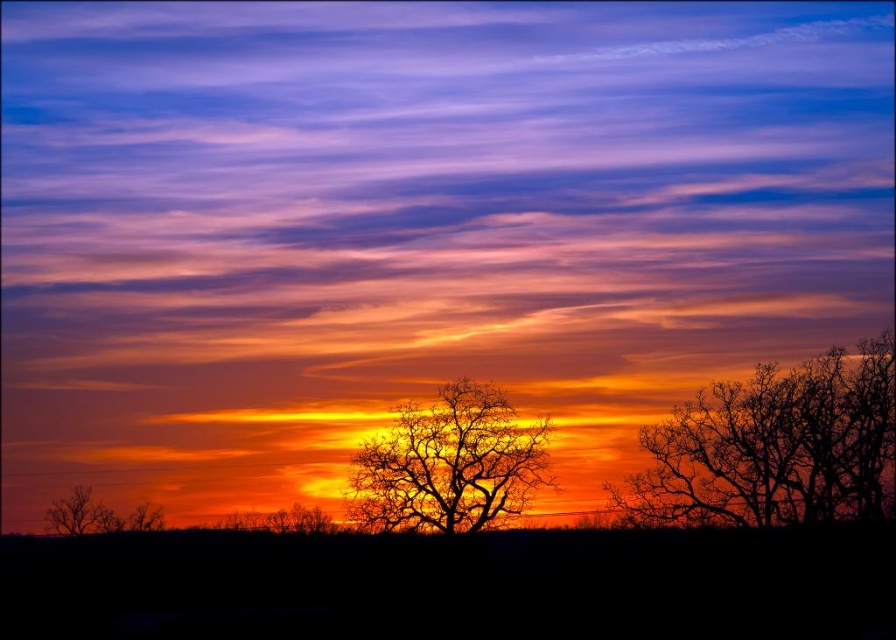
Question: Estimate the real-world distances between objects in this image. Which object is closer to the silhouette bare tree at center?

Choices:
 (A) silhouette bare tree at right
 (B) brown matte tree at lower left

Answer: (A)

Question: Where is silhouette bare tree at center located in relation to brown matte tree at lower left in the image?

Choices:
 (A) above
 (B) below

Answer: (A)

Question: Is silhouette bare tree at right bigger than brown matte tree at lower left?

Choices:
 (A) yes
 (B) no

Answer: (A)

Question: Does silhouette bare tree at right appear under brown matte tree at lower left?

Choices:
 (A) no
 (B) yes

Answer: (A)

Question: Which point is closer to the camera?

Choices:
 (A) silhouette bare tree at center
 (B) silhouette bare tree at right
 (C) brown matte tree at lower left

Answer: (B)

Question: Among these points, which one is farthest from the camera?

Choices:
 (A) (457, 404)
 (B) (690, 508)
 (C) (99, 516)

Answer: (C)